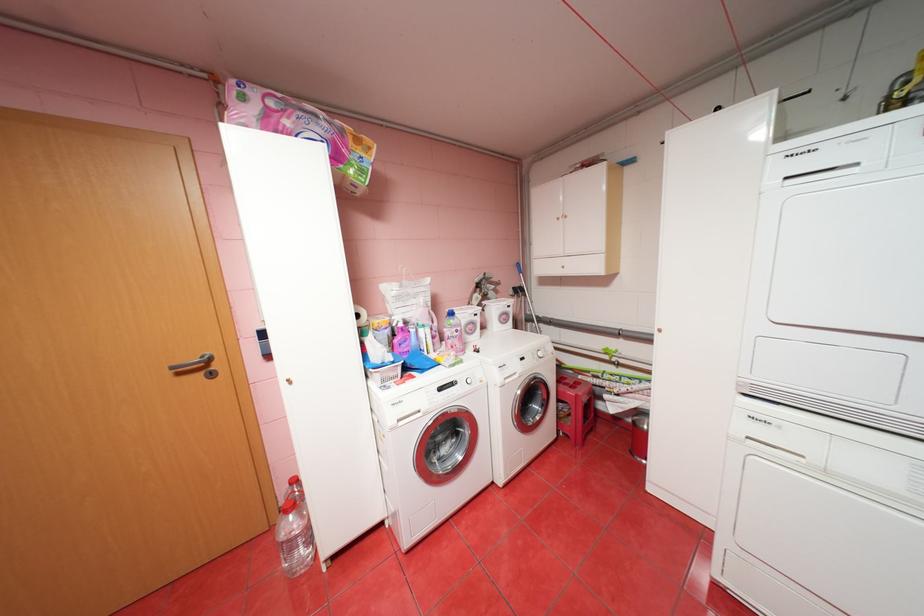
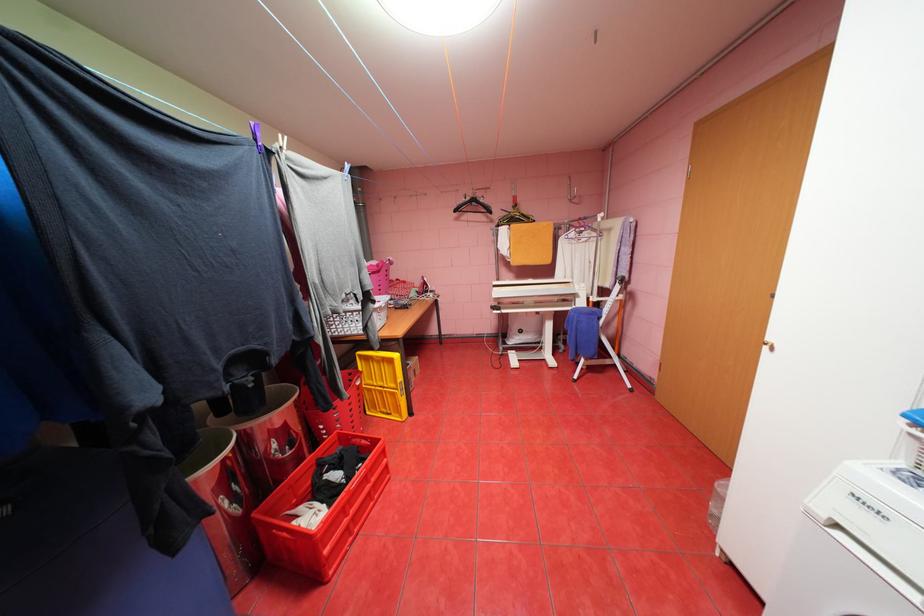
Where in the second image is the point corresponding to pixel 407 421 from the first image?

(845, 525)